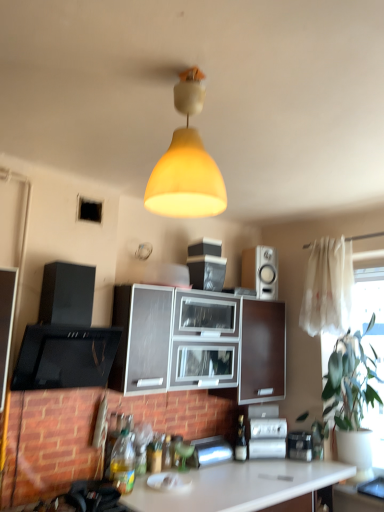
Question: Is green leafy plant at right positioned with its back to white glossy speaker at upper right?

Choices:
 (A) no
 (B) yes

Answer: (A)

Question: Is green leafy plant at right aimed at white glossy speaker at upper right?

Choices:
 (A) no
 (B) yes

Answer: (A)

Question: Is green leafy plant at right smaller than white glossy speaker at upper right?

Choices:
 (A) yes
 (B) no

Answer: (B)

Question: From the image's perspective, would you say green leafy plant at right is positioned over white glossy speaker at upper right?

Choices:
 (A) yes
 (B) no

Answer: (B)

Question: From a real-world perspective, is green leafy plant at right under white glossy speaker at upper right?

Choices:
 (A) no
 (B) yes

Answer: (B)

Question: From their relative heights in the image, would you say white glossy speaker at upper right is taller or shorter than metallic silver toaster at lower center, placed as the 1th appliance when sorted from left to right?

Choices:
 (A) short
 (B) tall

Answer: (B)

Question: Considering their positions, is white glossy speaker at upper right located in front of or behind metallic silver toaster at lower center, placed as the 1th appliance when sorted from left to right?

Choices:
 (A) behind
 (B) front

Answer: (A)

Question: Considering the positions of point (266, 272) and point (211, 442), is point (266, 272) closer or farther from the camera than point (211, 442)?

Choices:
 (A) farther
 (B) closer

Answer: (A)

Question: From a real-world perspective, relative to metallic silver toaster at lower center, which is the 3th appliance from right to left, is white glossy speaker at upper right vertically above or below?

Choices:
 (A) below
 (B) above

Answer: (B)

Question: Is white sheer curtain at right taller or shorter than metallic silver toaster at lower center, which is the 3th appliance from right to left?

Choices:
 (A) short
 (B) tall

Answer: (B)

Question: From the image's perspective, is white sheer curtain at right above or below metallic silver toaster at lower center, which is the 3th appliance from right to left?

Choices:
 (A) above
 (B) below

Answer: (A)

Question: Is white sheer curtain at right bigger or smaller than metallic silver toaster at lower center, which is the 3th appliance from right to left?

Choices:
 (A) big
 (B) small

Answer: (A)

Question: In terms of width, does white sheer curtain at right look wider or thinner when compared to metallic silver toaster at lower center, placed as the 1th appliance when sorted from left to right?

Choices:
 (A) wide
 (B) thin

Answer: (B)

Question: From the image's perspective, is translucent glass bottle at center, positioned as the first bottle in back-to-front order, above or below green leafy plant at right?

Choices:
 (A) above
 (B) below

Answer: (B)

Question: Considering the positions of translucent glass bottle at center, placed as the third bottle when sorted from left to right, and green leafy plant at right in the image, is translucent glass bottle at center, placed as the third bottle when sorted from left to right, bigger or smaller than green leafy plant at right?

Choices:
 (A) big
 (B) small

Answer: (B)